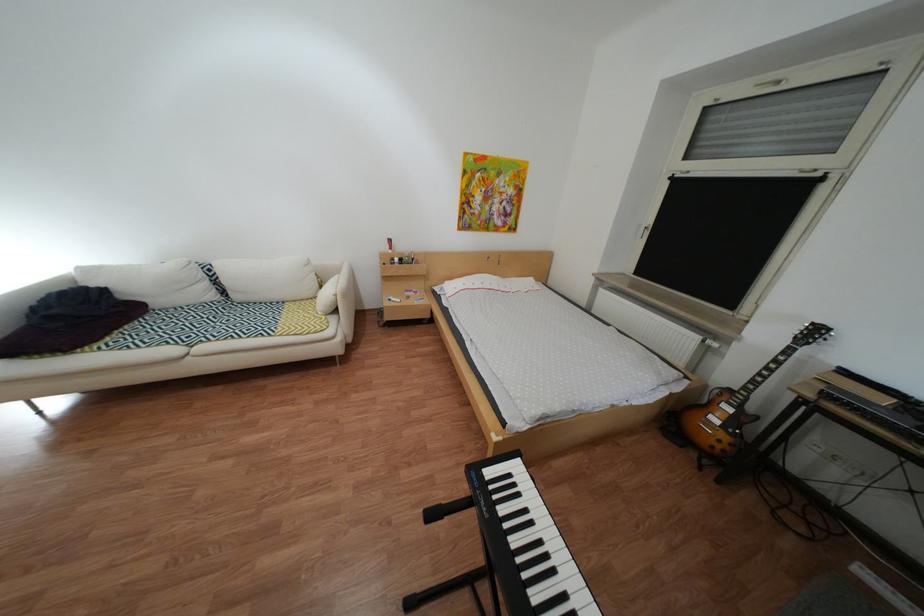
The height and width of the screenshot is (616, 924). Describe the element at coordinates (213, 323) in the screenshot. I see `a sofa sitting surface` at that location.